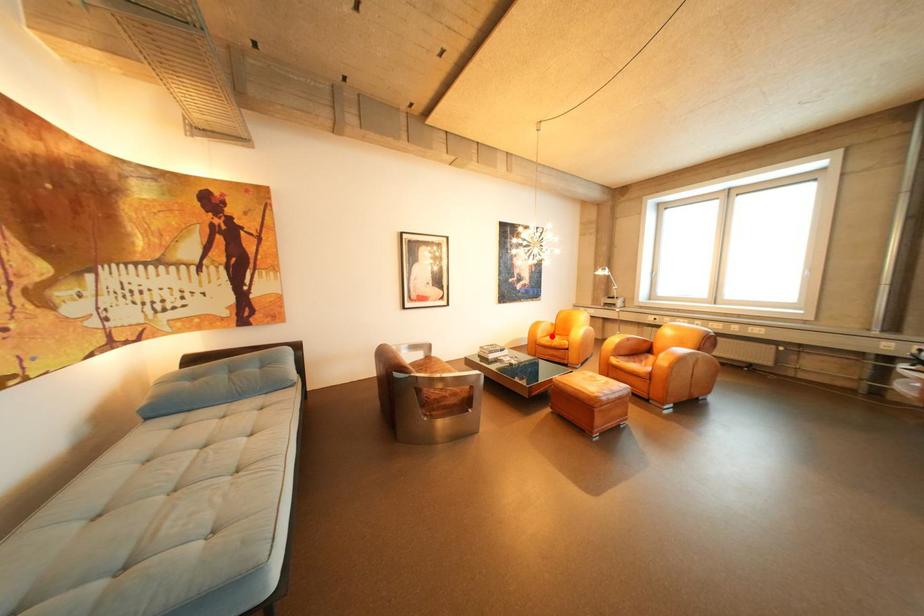
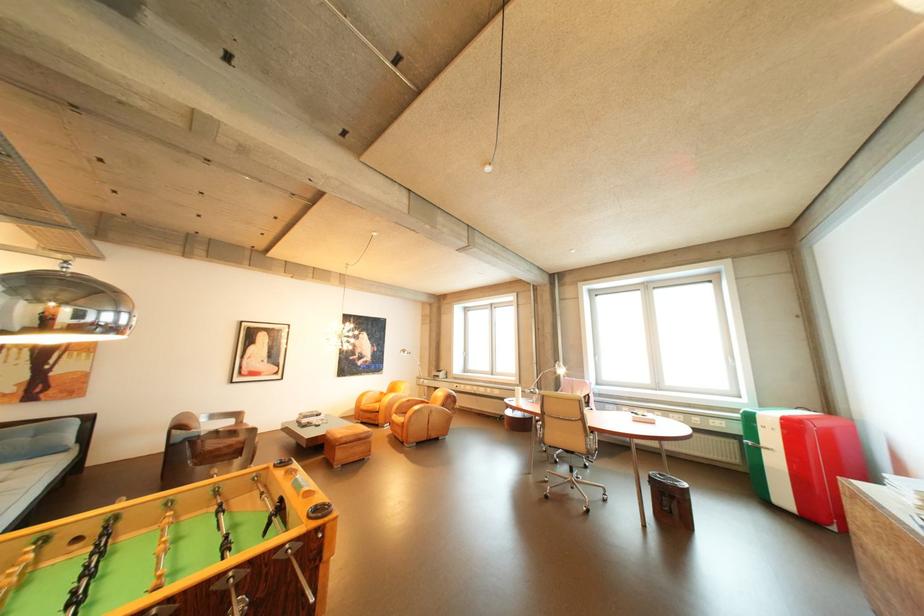
Question: I am providing you with two images of the same scene from different viewpoints. A red point is marked on the first image. Is the red point's position out of view in image 2?

Choices:
 (A) Yes
 (B) No

Answer: (B)